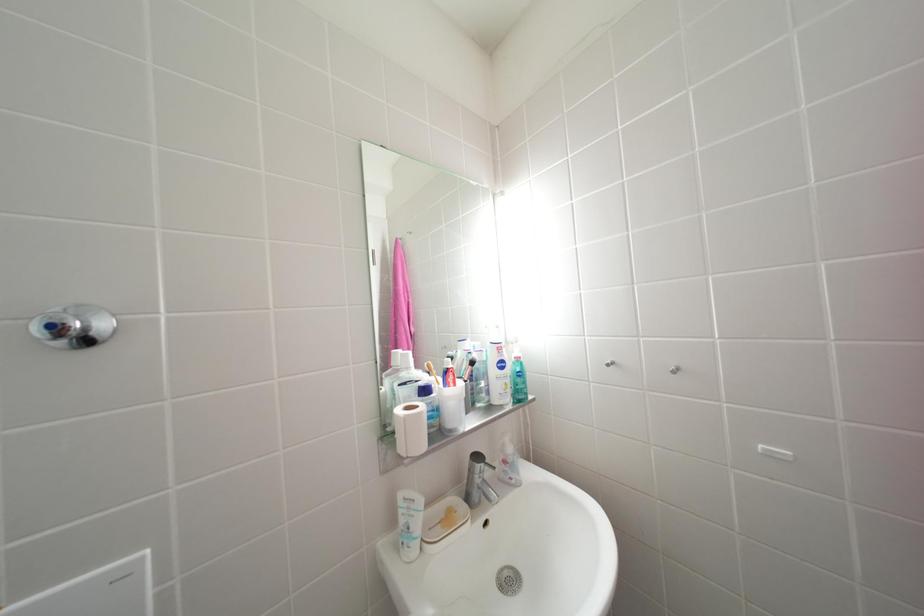
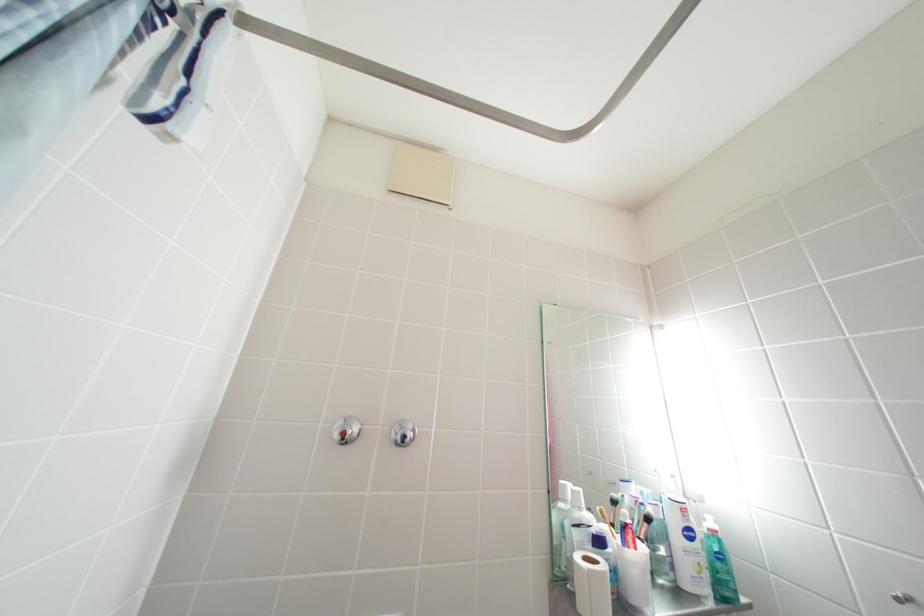
How did the camera likely rotate?

The camera's rotation is toward left-up.